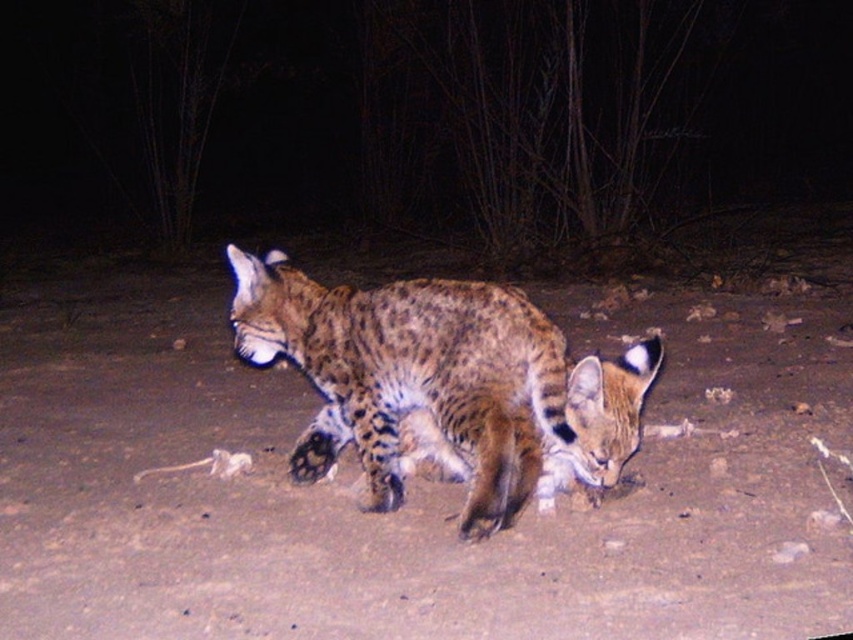
You are a wildlife researcher observing the nocturnal scene. You notice the brown sandy dirt at center and the spotted fur cat at center. Which object is positioned lower in the image?

The brown sandy dirt at center is located below the spotted fur cat at center, so it is positioned lower in the image.

You are a wildlife photographer aiming to capture a closeup of the bobcat in the foreground. You have two points marked in the image, point 1 at coordinates point [94,528] and point 2 at coordinates point [590,432]. Which point should you focus on to ensure the bobcat in the front is in sharp focus?

Point 1 at coordinates point [94,528] is further to the camera than point 2 at coordinates point [590,432]. Therefore, to focus on the bobcat in the foreground, you should choose point 1 at coordinates point [94,528] as it is closer to the camera.